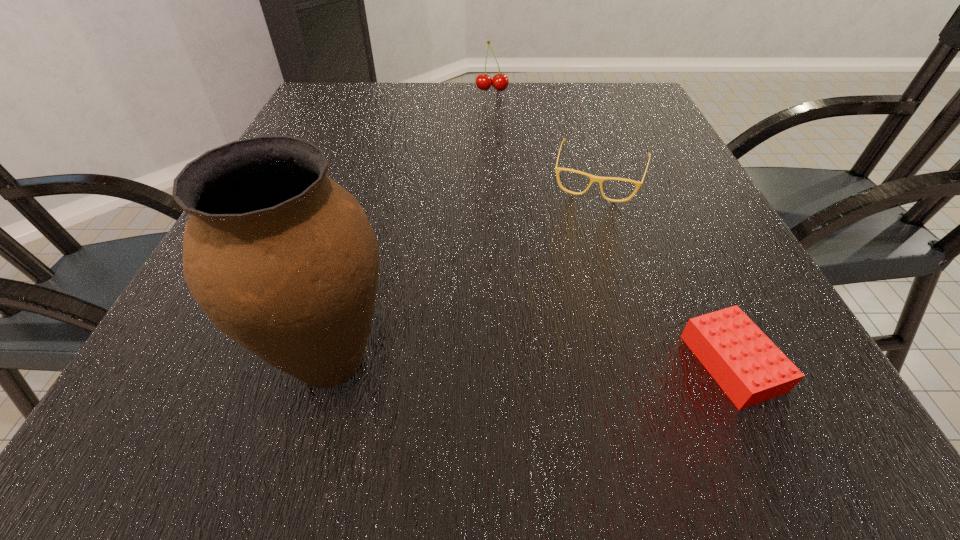
You are a GUI agent. You are given a task and a screenshot of the screen. Output one action in this format:
    pyautogui.click(x=<x>, y=<y>)
    Task: Click on the leftmost object
    
    Given the screenshot: What is the action you would take?
    pyautogui.click(x=284, y=260)

This screenshot has width=960, height=540. I want to click on urn, so click(284, 260).

The image size is (960, 540). I want to click on Lego, so click(x=747, y=365).

Identify the location of spectacles. (593, 178).

Locate an element on the screen. The width and height of the screenshot is (960, 540). the third shortest object is located at coordinates (500, 81).

Identify the location of cherry. The height and width of the screenshot is (540, 960). (500, 81).

At what (x,y) coordinates should I click in order to perform the action: click on vacant region located on the right of the tallest object. Please return your answer as a coordinate pair (x, y). Looking at the image, I should click on (564, 360).

Locate an element on the screen. vacant space situated on the back of the Lego is located at coordinates (654, 194).

The image size is (960, 540). Find the location of `free space located in front of the lenses of the spectacles`. free space located in front of the lenses of the spectacles is located at coordinates (559, 325).

You are a GUI agent. You are given a task and a screenshot of the screen. Output one action in this format:
    pyautogui.click(x=<x>, y=<y>)
    Task: Click on the free point located 0.230m in front of the lenses of the spectacles
    The width and height of the screenshot is (960, 540).
    Given the screenshot: What is the action you would take?
    pyautogui.click(x=569, y=284)